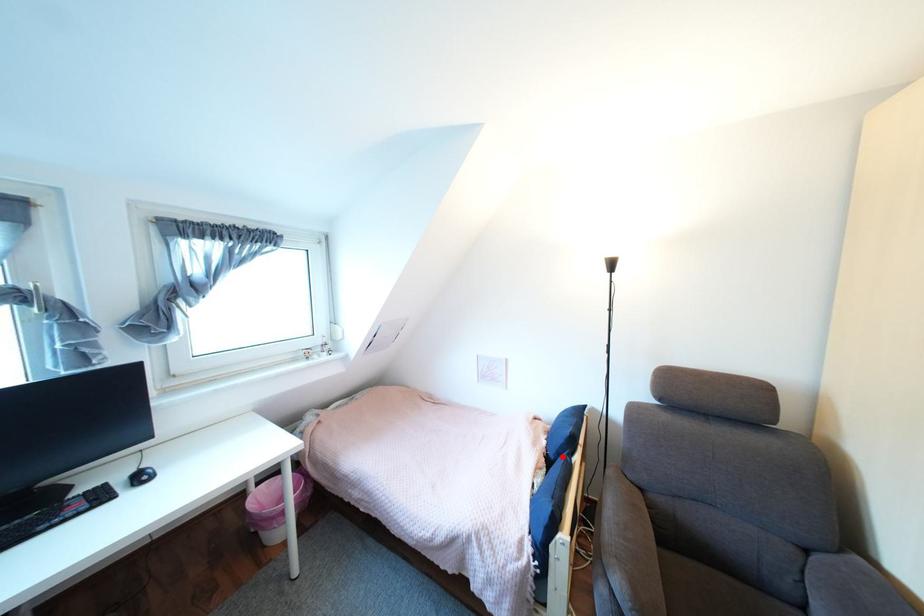
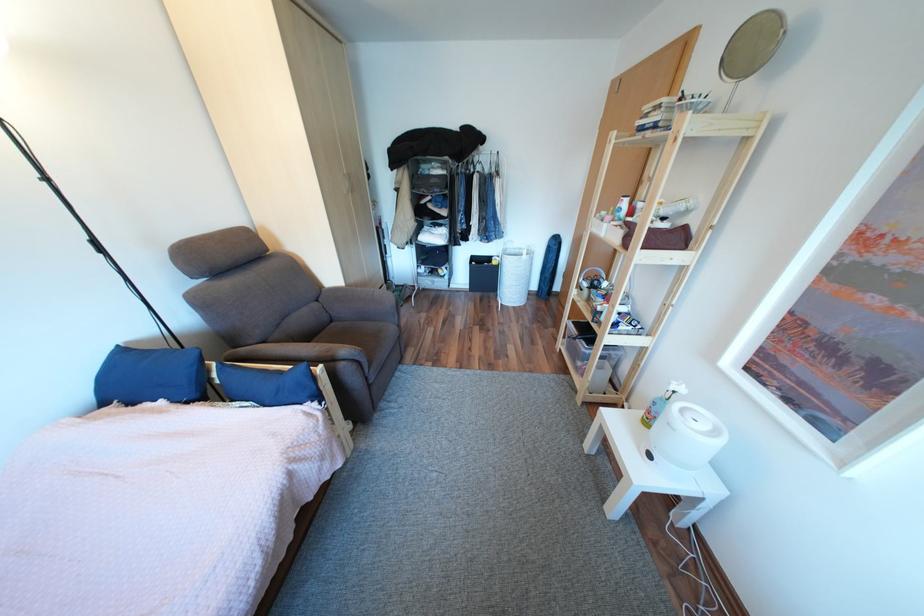
Find the pixel in the second image that matches the highlighted location in the first image.

(205, 395)